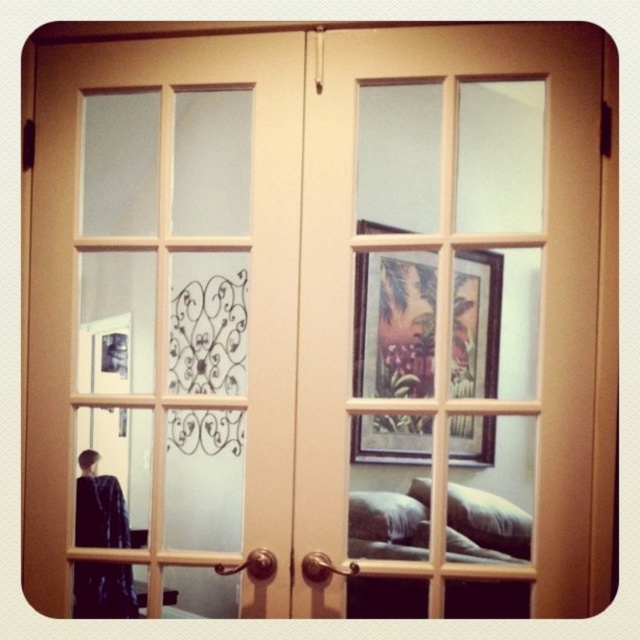
Question: Which is nearer to the matte wood door at center?

Choices:
 (A) dark blue fabric at lower left
 (B) white soft pillow at lower right

Answer: (A)

Question: Is soft beige pillow at lower right smaller than white soft pillow at lower right?

Choices:
 (A) yes
 (B) no

Answer: (B)

Question: Is matte wood door at center below dark blue fabric at lower left?

Choices:
 (A) no
 (B) yes

Answer: (A)

Question: Which of the following is the closest to the observer?

Choices:
 (A) white soft pillow at lower right
 (B) dark blue fabric at lower left

Answer: (A)

Question: Can you confirm if matte wood door at center is positioned to the left of soft beige pillow at lower right?

Choices:
 (A) yes
 (B) no

Answer: (A)

Question: Which point is closer to the camera taking this photo?

Choices:
 (A) (387, 540)
 (B) (243, 340)
 (C) (452, 502)
 (D) (97, 588)

Answer: (C)